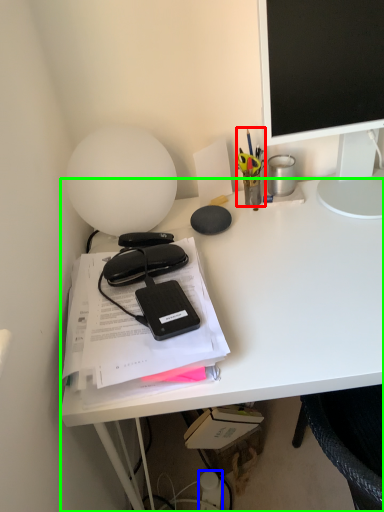
Question: Considering the real-world distances, which object is closest to stationery (highlighted by a red box)? stationery (highlighted by a blue box) or desk (highlighted by a green box).

Choices:
 (A) stationery
 (B) desk

Answer: (B)